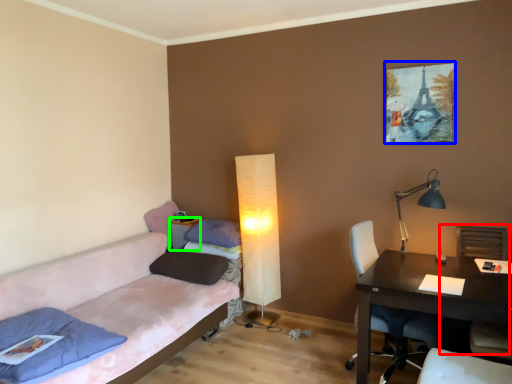
Question: Which object is positioned closest to armchair (highlighted by a red box)? Select from picture frame (highlighted by a blue box) and side table (highlighted by a green box).

Choices:
 (A) picture frame
 (B) side table

Answer: (A)